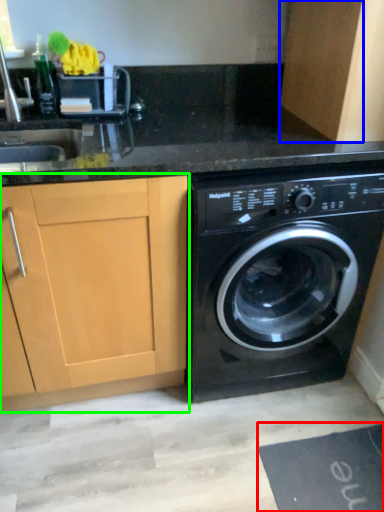
Question: Estimate the real-world distances between objects in this image. Which object is farther from bath mat (highlighted by a red box), cabinetry (highlighted by a blue box) or cabinetry (highlighted by a green box)?

Choices:
 (A) cabinetry
 (B) cabinetry

Answer: (A)